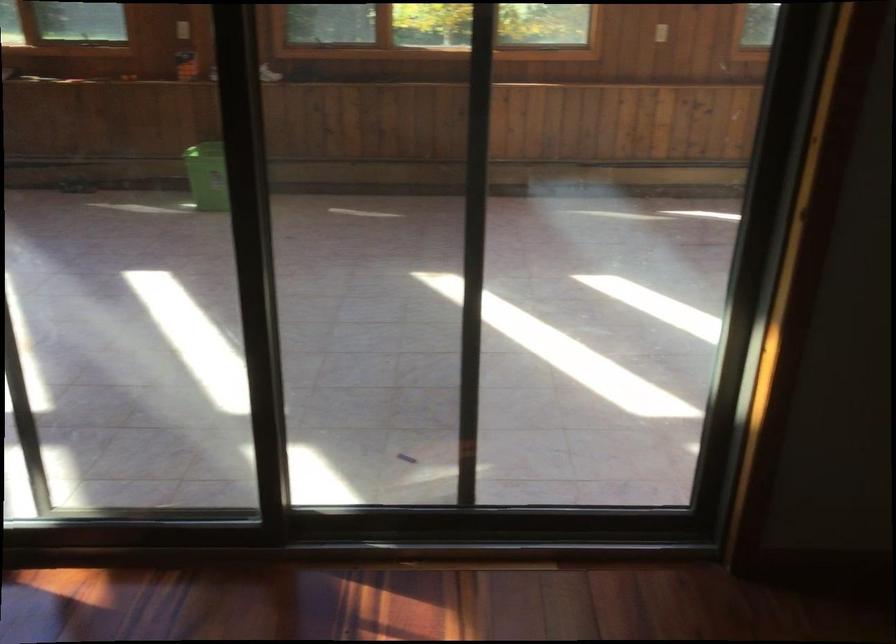
This screenshot has height=644, width=896. What do you see at coordinates (474, 243) in the screenshot? I see `the sliding door frame` at bounding box center [474, 243].